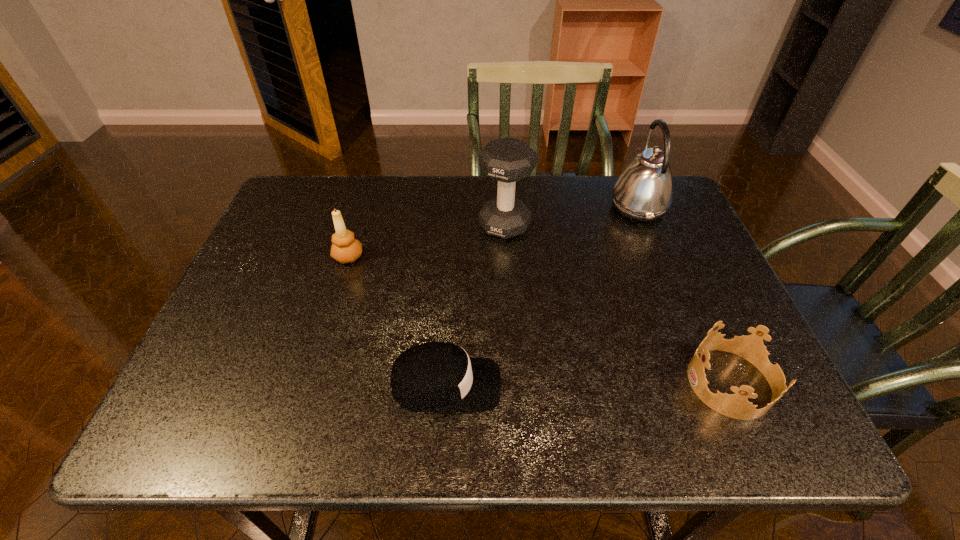
This screenshot has height=540, width=960. I want to click on kettle, so (x=644, y=192).

This screenshot has height=540, width=960. I want to click on dumbbell, so click(x=507, y=160).

Where is `candle_holder`? candle_holder is located at coordinates (345, 248).

Locate an element on the screen. the third farthest object is located at coordinates (345, 248).

Where is `tiara`? This screenshot has height=540, width=960. tiara is located at coordinates (751, 347).

Find the location of `the shortest object`. the shortest object is located at coordinates (436, 376).

Identify the location of vacant position located from the spout of the kettle. This screenshot has width=960, height=540. (486, 207).

The image size is (960, 540). Find the location of `free space located from the spout of the kettle`. free space located from the spout of the kettle is located at coordinates [564, 207].

Locate an element on the screen. The width and height of the screenshot is (960, 540). free region located 0.070m from the spout of the kettle is located at coordinates (585, 207).

The width and height of the screenshot is (960, 540). I want to click on vacant space located 0.170m on the left of the dumbbell, so click(x=418, y=225).